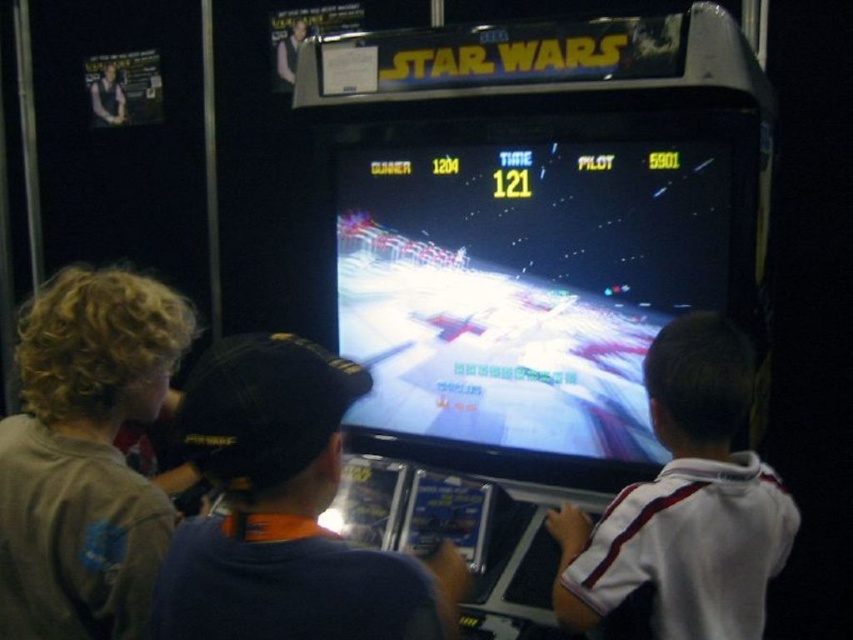
You are standing at the entrance of the arcade. To play the game, you need to walk to the shiny plastic arcade machine at center. If your current position is at point 0.0, where should you walk to reach it?

You should walk to point [525,284] to reach the shiny plastic arcade machine at center.

You are a photographer standing at the center of the room. You want to take a photo of the brown cotton shirt at left. Where should you position your camera to capture the shirt in the frame?

The brown cotton shirt at left is located at point (85, 456), so you should position the camera to the left side of the frame to capture the shirt.